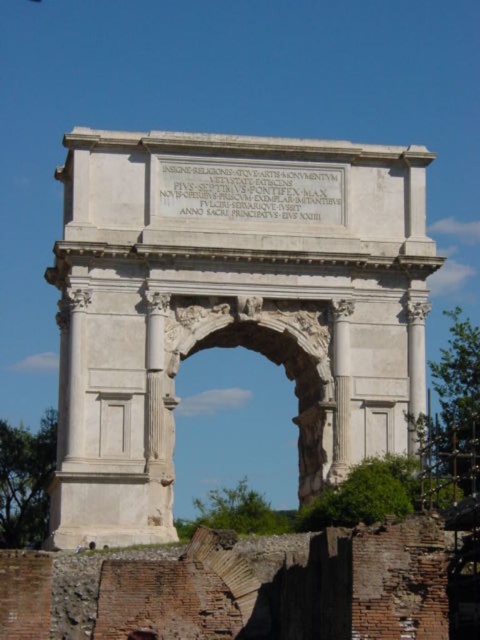
Question: Does white stone arch at center appear on the right side of white stone archway at center?

Choices:
 (A) yes
 (B) no

Answer: (B)

Question: Is white stone arch at center thinner than white stone archway at center?

Choices:
 (A) yes
 (B) no

Answer: (B)

Question: Which point is closer to the camera?

Choices:
 (A) (156, 410)
 (B) (195, 330)

Answer: (A)

Question: Which point is farther to the camera?

Choices:
 (A) (180, 333)
 (B) (363, 304)

Answer: (B)

Question: Observing the image, what is the correct spatial positioning of white stone arch at center in reference to white stone archway at center?

Choices:
 (A) above
 (B) below

Answer: (A)